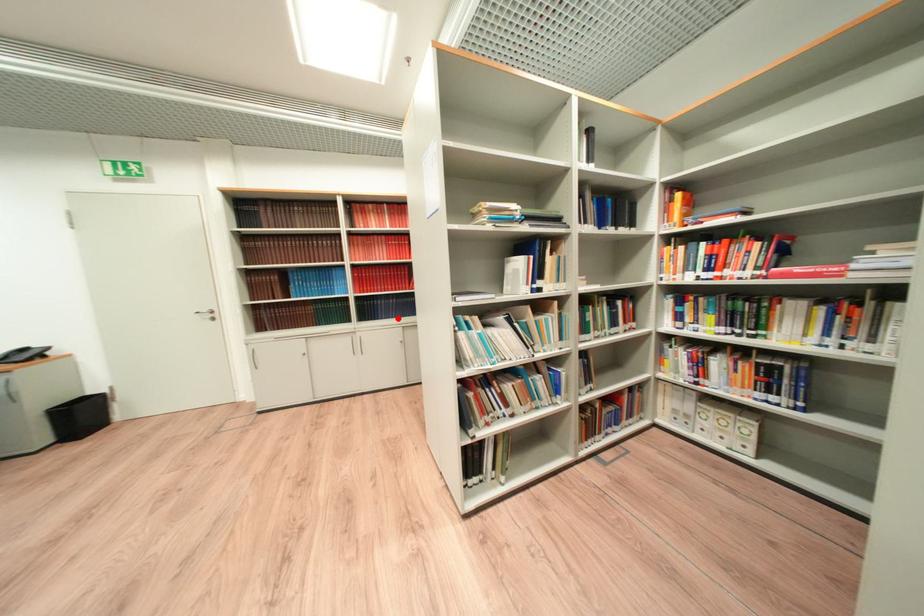
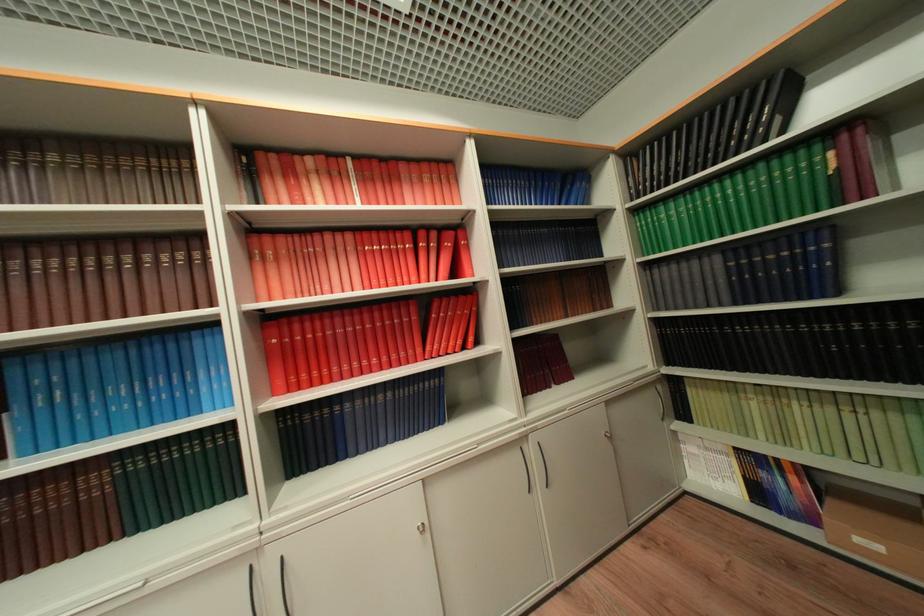
Question: I am providing you with two images of the same scene from different viewpoints. Given a red point in image1, look at the same physical point in image2. Is it:

Choices:
 (A) Closer to the viewpoint
 (B) Farther from the viewpoint

Answer: (A)